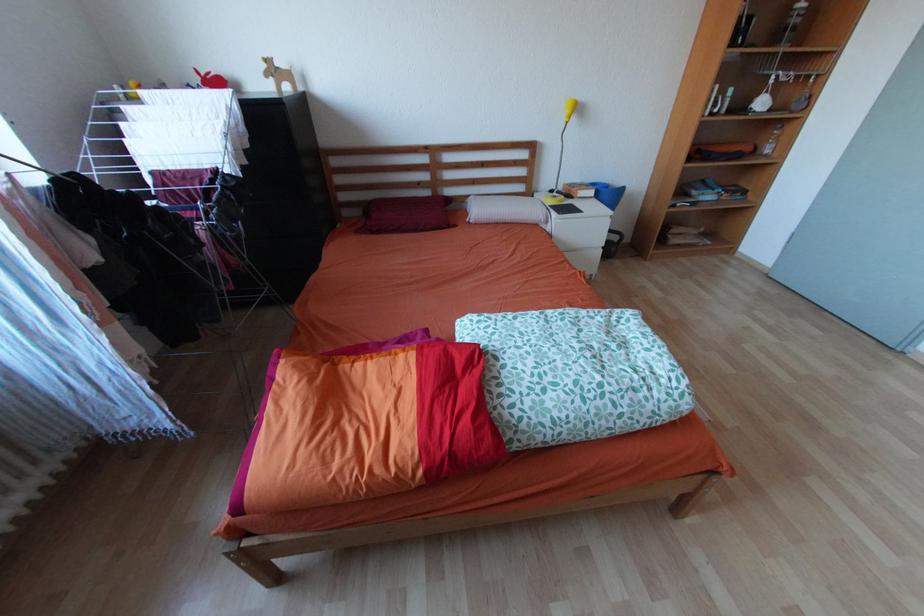
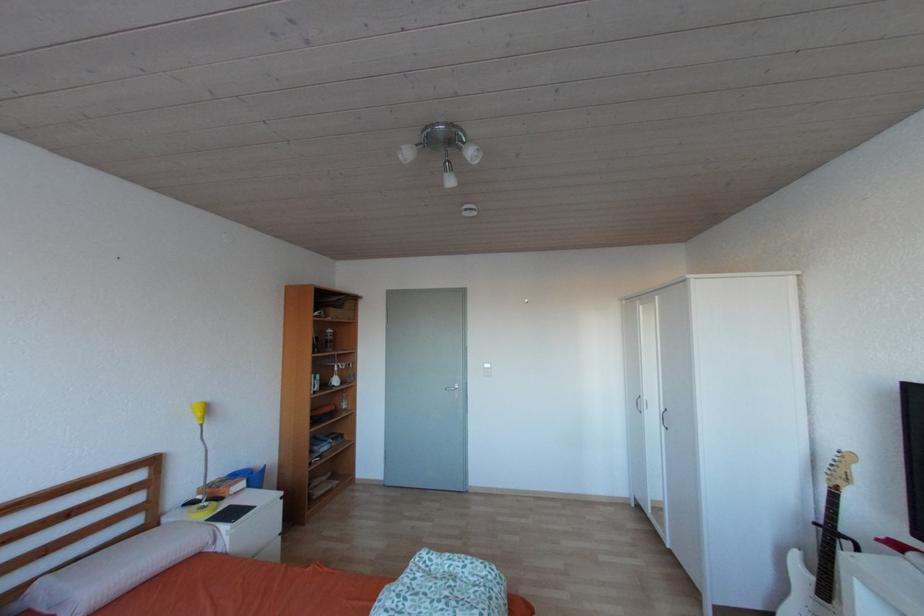
Question: The camera is either moving clockwise (left) or counter-clockwise (right) around the object. The first image is from the beginning of the video and the second image is from the end. Is the camera moving left or right when shooting the video?

Choices:
 (A) Left
 (B) Right

Answer: (A)